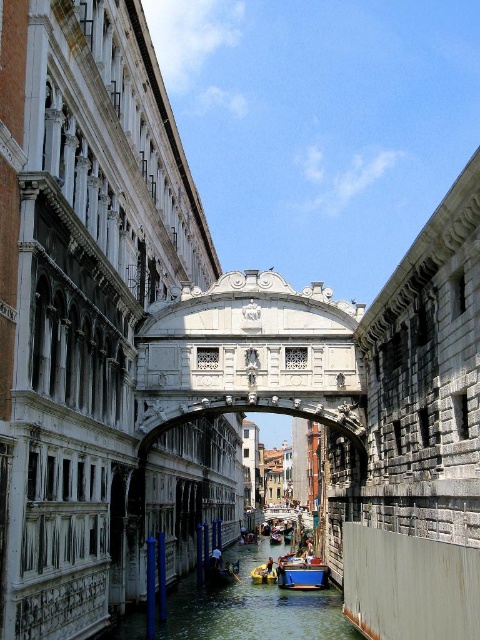
Between greenish water at center and blue matte boat at center, which one has less height?

blue matte boat at center is shorter.

Looking at this image, does greenish water at center appear under blue matte boat at center?

Yes, greenish water at center is below blue matte boat at center.

Is point (283, 625) positioned behind point (309, 588)?

No, it is not.

This screenshot has width=480, height=640. Identify the location of greenish water at center. (253, 605).